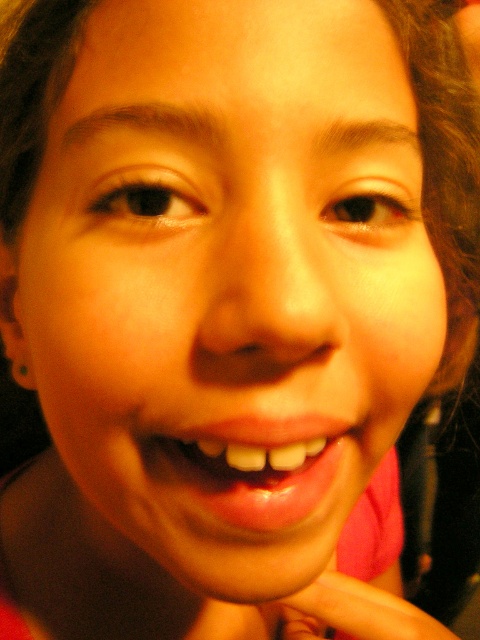
Which is above, shiny pink lips at center or pink matte hand at lower center?

shiny pink lips at center

Between point (287, 422) and point (425, 621), which one is positioned behind?

The point (425, 621) is behind.

Identify the location of shiny pink lips at center. 250,467.